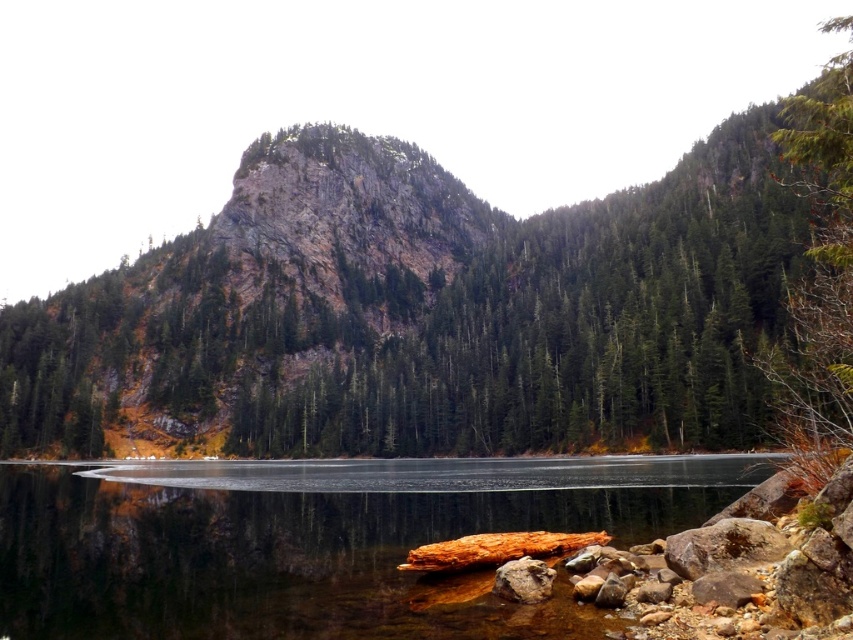
Question: Which object is closer to the camera taking this photo?

Choices:
 (A) smooth rock water at center
 (B) rusty metallic rock at lower center
 (C) green textured tree at right

Answer: (A)

Question: Does smooth rock water at center appear on the left side of green textured tree at right?

Choices:
 (A) no
 (B) yes

Answer: (B)

Question: Does green textured tree at right have a greater width compared to rusty metallic rock at lower center?

Choices:
 (A) yes
 (B) no

Answer: (A)

Question: Considering the relative positions of green textured tree at right and rusty metallic rock at lower center in the image provided, where is green textured tree at right located with respect to rusty metallic rock at lower center?

Choices:
 (A) below
 (B) above

Answer: (B)

Question: Which object appears farthest from the camera in this image?

Choices:
 (A) green textured tree at right
 (B) rusty metallic rock at lower center
 (C) smooth rock water at center

Answer: (B)

Question: Which object is the closest to the green textured tree at right?

Choices:
 (A) rusty metallic rock at lower center
 (B) smooth rock water at center

Answer: (A)